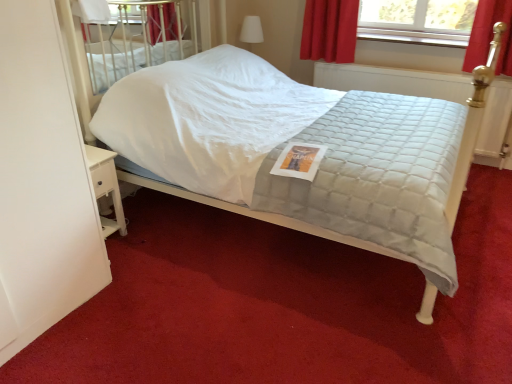
Question: Is white quilted fabric bed at center to the left of white matte screen door at left from the viewer's perspective?

Choices:
 (A) no
 (B) yes

Answer: (A)

Question: Does white quilted fabric bed at center turn towards white matte screen door at left?

Choices:
 (A) no
 (B) yes

Answer: (A)

Question: Does white quilted fabric bed at center have a lesser height compared to white matte screen door at left?

Choices:
 (A) no
 (B) yes

Answer: (B)

Question: Is white quilted fabric bed at center positioned with its back to white matte screen door at left?

Choices:
 (A) yes
 (B) no

Answer: (B)

Question: From the image's perspective, is white quilted fabric bed at center located above white matte screen door at left?

Choices:
 (A) yes
 (B) no

Answer: (A)

Question: Considering the positions of point (9, 286) and point (117, 198), is point (9, 286) closer or farther from the camera than point (117, 198)?

Choices:
 (A) closer
 (B) farther

Answer: (A)

Question: Considering the positions of white matte screen door at left and white wood nightstand at lower left in the image, is white matte screen door at left bigger or smaller than white wood nightstand at lower left?

Choices:
 (A) big
 (B) small

Answer: (A)

Question: In the image, is white matte screen door at left positioned in front of or behind white wood nightstand at lower left?

Choices:
 (A) front
 (B) behind

Answer: (A)

Question: Is white matte screen door at left to the left or to the right of white wood nightstand at lower left in the image?

Choices:
 (A) left
 (B) right

Answer: (A)

Question: Looking at the image, does white wood nightstand at lower left seem bigger or smaller compared to white matte screen door at left?

Choices:
 (A) small
 (B) big

Answer: (A)

Question: Is white wood nightstand at lower left wider or thinner than white matte screen door at left?

Choices:
 (A) thin
 (B) wide

Answer: (A)

Question: Is white wood nightstand at lower left inside the boundaries of white matte screen door at left, or outside?

Choices:
 (A) outside
 (B) inside

Answer: (A)

Question: From the image's perspective, relative to white matte screen door at left, is white wood nightstand at lower left above or below?

Choices:
 (A) below
 (B) above

Answer: (A)

Question: Looking at the image, does white quilted fabric bed at center seem bigger or smaller compared to white wood nightstand at lower left?

Choices:
 (A) big
 (B) small

Answer: (A)

Question: From the image's perspective, is white quilted fabric bed at center located above or below white wood nightstand at lower left?

Choices:
 (A) below
 (B) above

Answer: (B)